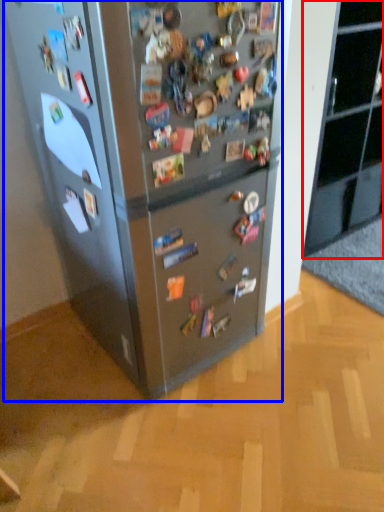
Question: Which object is closer to the camera taking this photo, cabinetry (highlighted by a red box) or refrigerator (highlighted by a blue box)?

Choices:
 (A) cabinetry
 (B) refrigerator

Answer: (B)